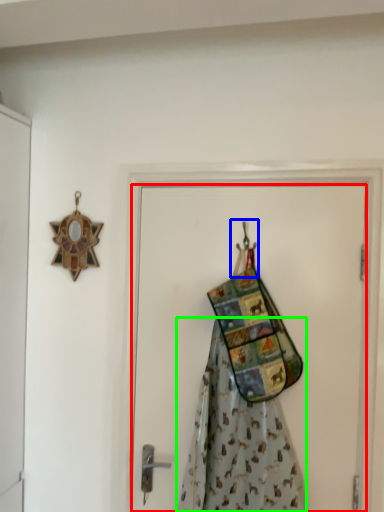
Question: Which object is positioned closest to door (highlighted by a red box)? Select from hanger (highlighted by a blue box) and fancy dress (highlighted by a green box).

Choices:
 (A) hanger
 (B) fancy dress

Answer: (B)